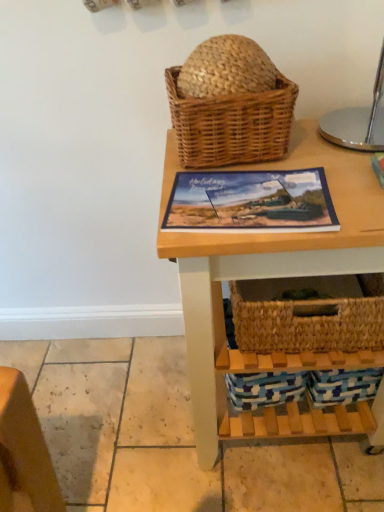
Image resolution: width=384 pixels, height=512 pixels. In order to click on blank space situated above matte plastic picture frame at center (from a real-world perspective) in this screenshot , I will do `click(246, 193)`.